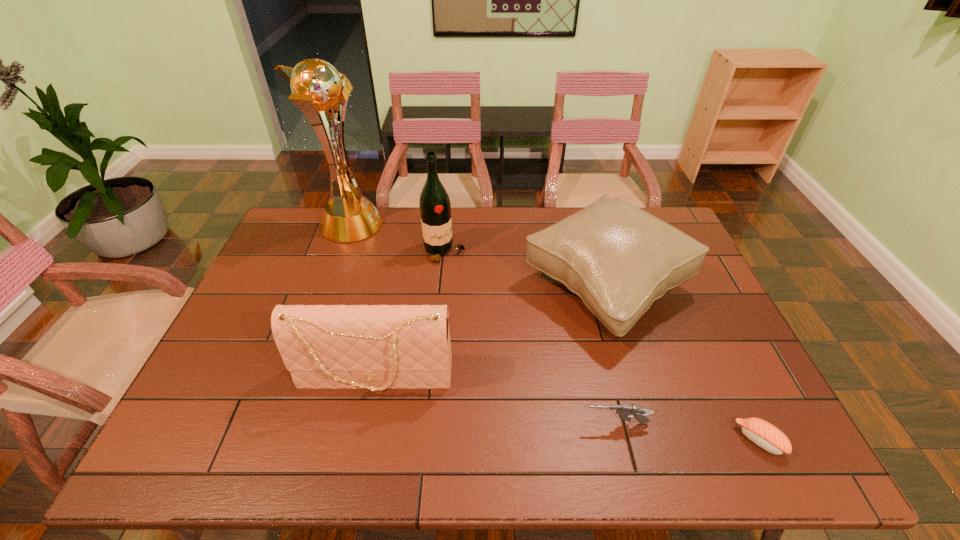
The height and width of the screenshot is (540, 960). I want to click on sushi present at the right edge, so click(x=765, y=435).

Where is `object that is positioned at the far left corner`? This screenshot has width=960, height=540. object that is positioned at the far left corner is located at coordinates (316, 86).

Image resolution: width=960 pixels, height=540 pixels. I want to click on object present at the far right corner, so click(618, 258).

This screenshot has width=960, height=540. Identify the location of object present at the near right corner. (765, 435).

In the image, there is a desktop. Where is `free space at the far edge`? Image resolution: width=960 pixels, height=540 pixels. free space at the far edge is located at coordinates (516, 244).

In the image, there is a desktop. At what (x,y) coordinates should I click in order to perform the action: click on vacant space at the near edge. Please return your answer as a coordinate pair (x, y). This screenshot has width=960, height=540. Looking at the image, I should click on (314, 446).

The image size is (960, 540). I want to click on vacant space at the right edge of the desktop, so click(x=671, y=292).

Locate an element on the screen. free space at the far left corner of the desktop is located at coordinates (319, 244).

You are a GUI agent. You are given a task and a screenshot of the screen. Output one action in this format:
    pyautogui.click(x=<x>, y=<y>)
    Task: Click on the vacant space at the near right corner of the desktop
    The image size is (960, 540).
    Given the screenshot: What is the action you would take?
    pyautogui.click(x=742, y=455)

Identify the location of unoccupied position between the handbag and the cushion. (491, 332).